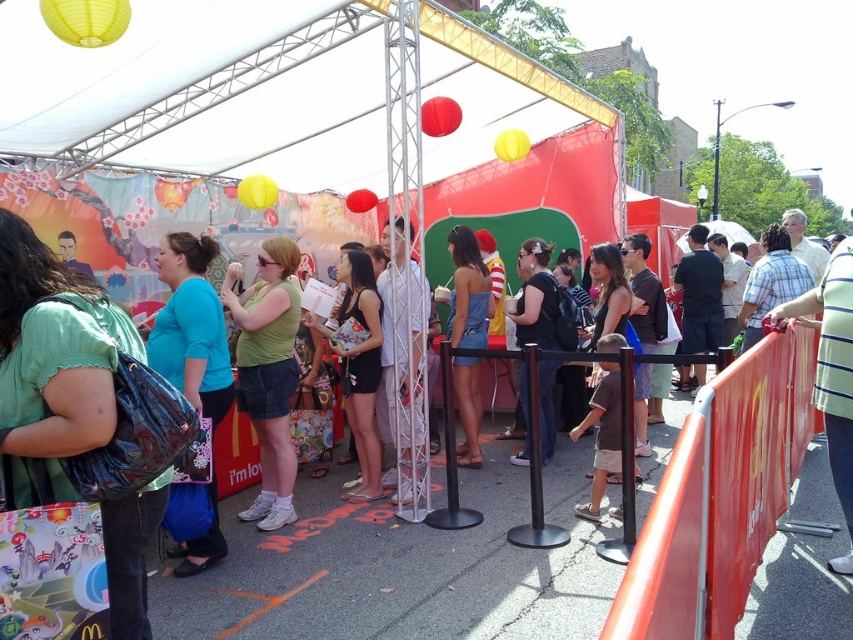
Which is more to the right, green fabric shirt at center or blue fabric purse at center?

green fabric shirt at center

Is green fabric shirt at center taller than blue fabric purse at center?

No, green fabric shirt at center is not taller than blue fabric purse at center.

Who is more forward, (7, 403) or (173, 307)?

Point (7, 403)

Where is `green fabric shirt at center`? This screenshot has width=853, height=640. green fabric shirt at center is located at coordinates coord(51,365).

In the scene shown: Does blue fabric purse at center appear on the right side of orange matte line at lower center?

Incorrect, blue fabric purse at center is not on the right side of orange matte line at lower center.

Does blue fabric purse at center have a lesser width compared to orange matte line at lower center?

Correct, blue fabric purse at center's width is less than orange matte line at lower center's.

What do you see at coordinates (190, 326) in the screenshot? The width and height of the screenshot is (853, 640). I see `blue fabric purse at center` at bounding box center [190, 326].

Find the location of a particular element. This screenshot has height=640, width=853. blue fabric purse at center is located at coordinates (190, 326).

Between denim shorts at center and orange matte line at lower center, which one has less height?

orange matte line at lower center is shorter.

Who is taller, denim shorts at center or orange matte line at lower center?

With more height is denim shorts at center.

Which is behind, point (457, 362) or point (277, 596)?

Positioned behind is point (457, 362).

At what (x,y) coordinates should I click in order to perform the action: click on denim shorts at center. Please return your answer as a coordinate pair (x, y). The height and width of the screenshot is (640, 853). Looking at the image, I should click on (468, 291).